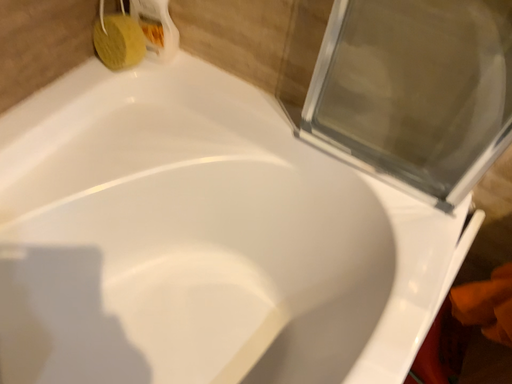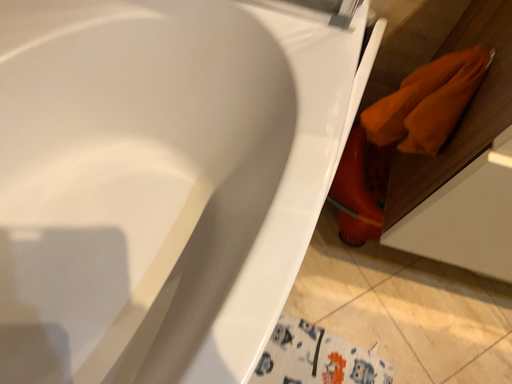
Question: How did the camera likely rotate when shooting the video?

Choices:
 (A) rotated right
 (B) rotated left

Answer: (A)